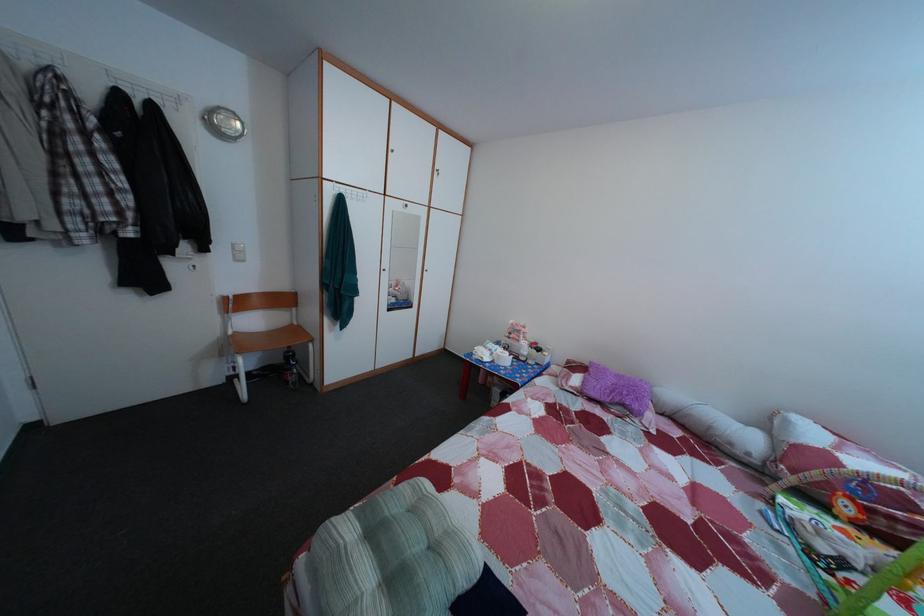
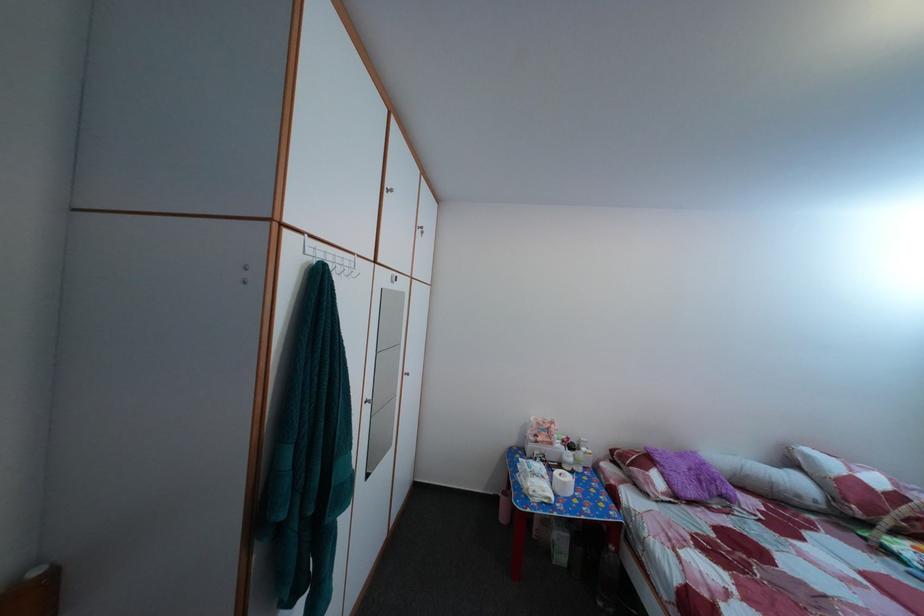
Locate, in the second image, the point that corresponds to point 544,351 in the first image.

(578, 447)